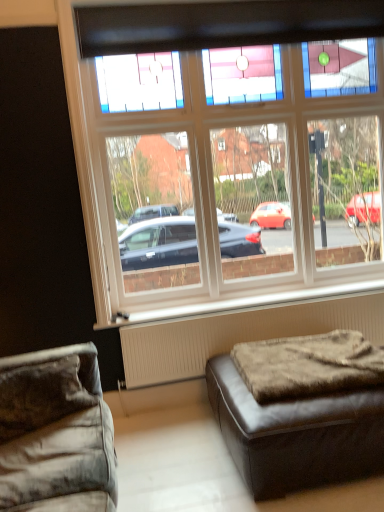
Locate an element on the screen. The height and width of the screenshot is (512, 384). empty space that is ontop of white textured radiator at lower right (from a real-world perspective) is located at coordinates (254, 305).